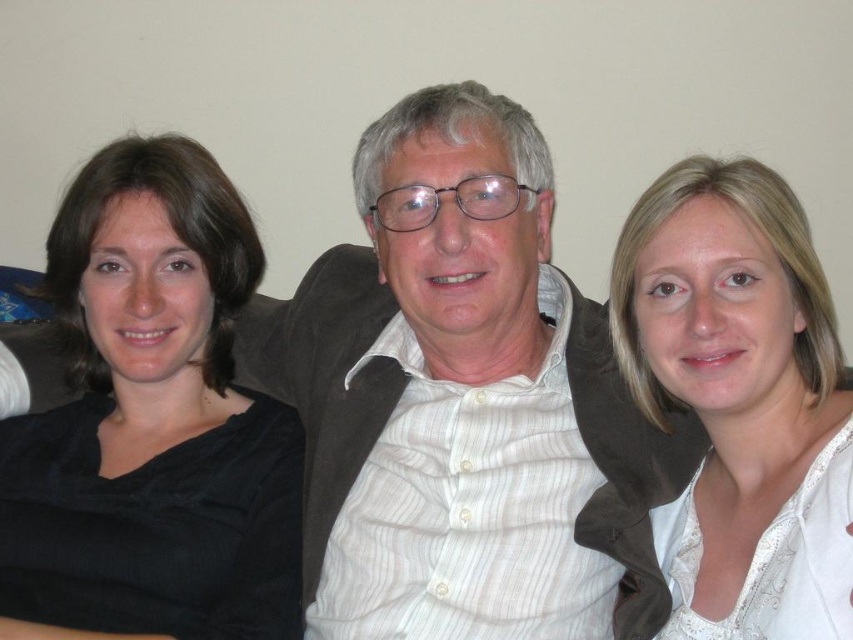
Question: Can you confirm if black matte shirt at left is thinner than white lace blouse at right?

Choices:
 (A) no
 (B) yes

Answer: (A)

Question: Can you confirm if black matte shirt at left is thinner than white lace blouse at right?

Choices:
 (A) no
 (B) yes

Answer: (A)

Question: Which object appears farthest from the camera in this image?

Choices:
 (A) black matte shirt at left
 (B) white lace blouse at right

Answer: (A)

Question: Considering the relative positions of black matte shirt at left and white lace blouse at right in the image provided, where is black matte shirt at left located with respect to white lace blouse at right?

Choices:
 (A) above
 (B) below

Answer: (B)